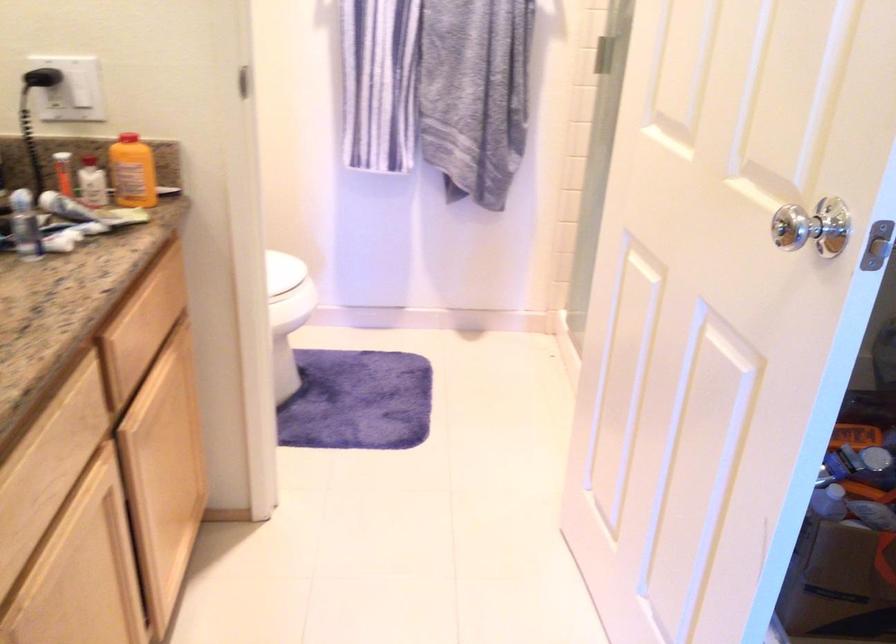
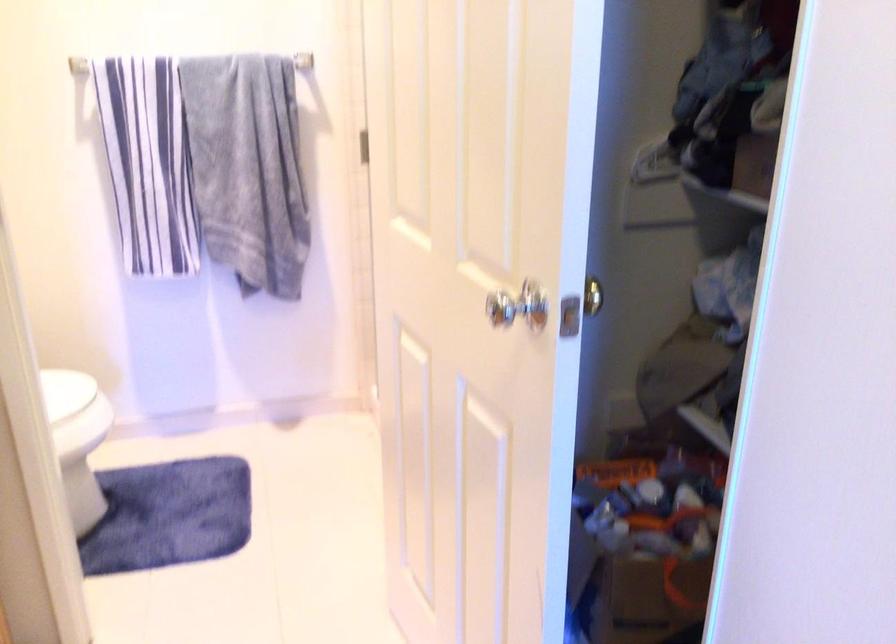
Locate, in the second image, the point that corresponds to (280,279) in the first image.

(72, 400)